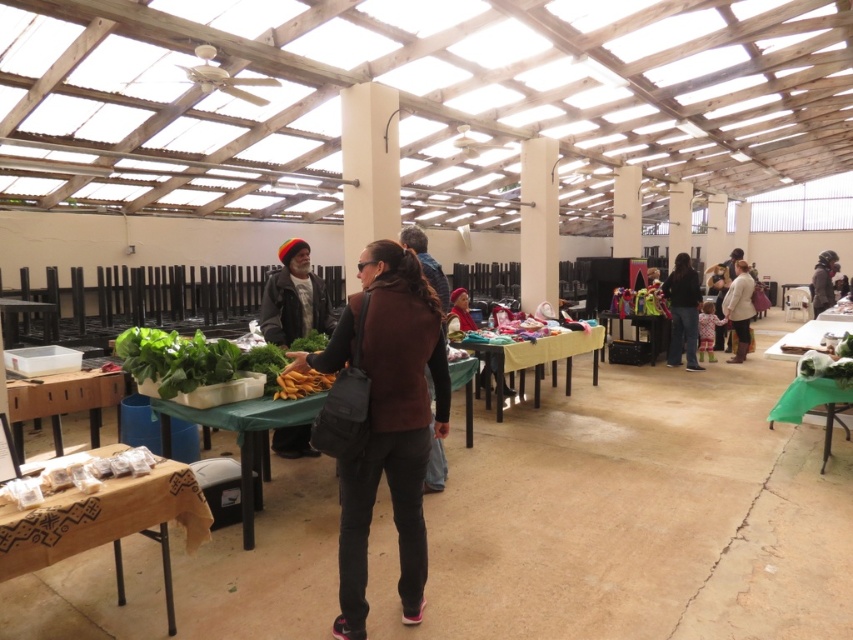
You are standing in the market and want to walk towards the two points marked in the image. Which point, point (184, 392) or point (68, 387), is closer to you?

Point (184, 392) is closer to you than point (68, 387).

You are a customer at the market and want to pick up some vegetables. Which object should you approach first, the green leafy vegetables at left or the wooden table at lower left?

You should approach the wooden table at lower left first because the green leafy vegetables at left are positioned over it, meaning the table is below the vegetables and likely holds them.